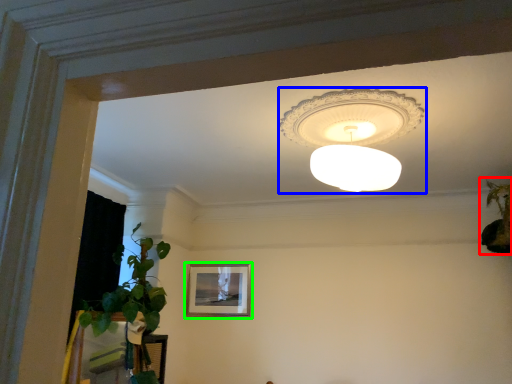
Question: Which is farther away from houseplant (highlighted by a red box)? lamp (highlighted by a blue box) or picture frame (highlighted by a green box)?

Choices:
 (A) lamp
 (B) picture frame

Answer: (B)